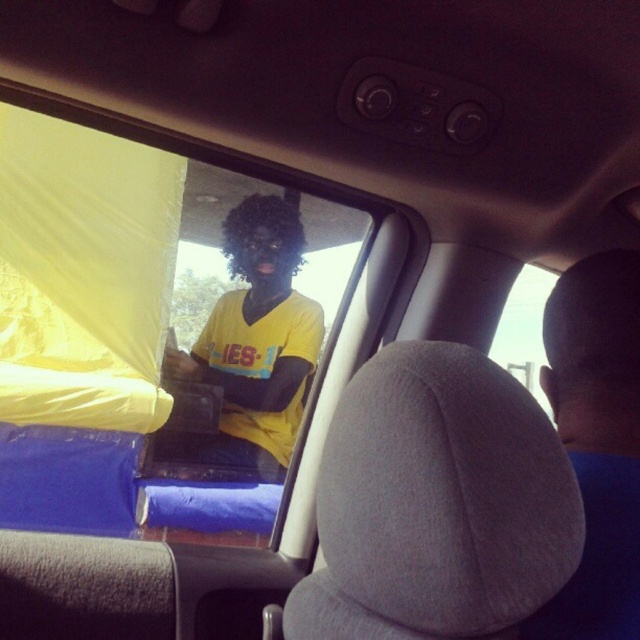
Question: Which object appears closest to the camera in this image?

Choices:
 (A) yellow matte shirt at center
 (B) dark curly hair at center
 (C) yellow fabric at left

Answer: (C)

Question: Can you confirm if yellow fabric at left is thinner than dark curly hair at center?

Choices:
 (A) yes
 (B) no

Answer: (B)

Question: Can you confirm if yellow fabric at left is positioned below yellow matte shirt at center?

Choices:
 (A) no
 (B) yes

Answer: (A)

Question: Among these points, which one is farthest from the camera?

Choices:
 (A) (292, 228)
 (B) (3, 116)
 (C) (218, 454)

Answer: (A)

Question: Which point appears closest to the camera in this image?

Choices:
 (A) (211, 461)
 (B) (300, 250)

Answer: (A)

Question: Does yellow fabric at left appear on the left side of yellow matte shirt at center?

Choices:
 (A) yes
 (B) no

Answer: (A)